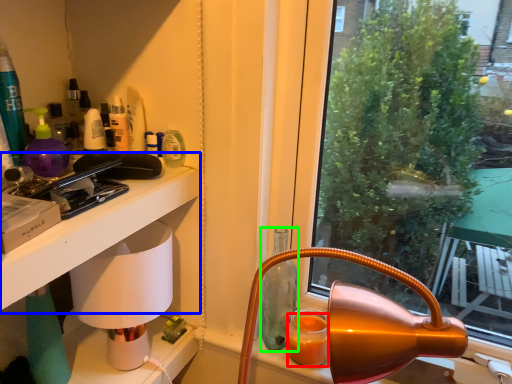
Question: Estimate the real-world distances between objects in this image. Which object is farther from orange juice (highlighted by a red box), table (highlighted by a blue box) or bottle (highlighted by a green box)?

Choices:
 (A) table
 (B) bottle

Answer: (A)